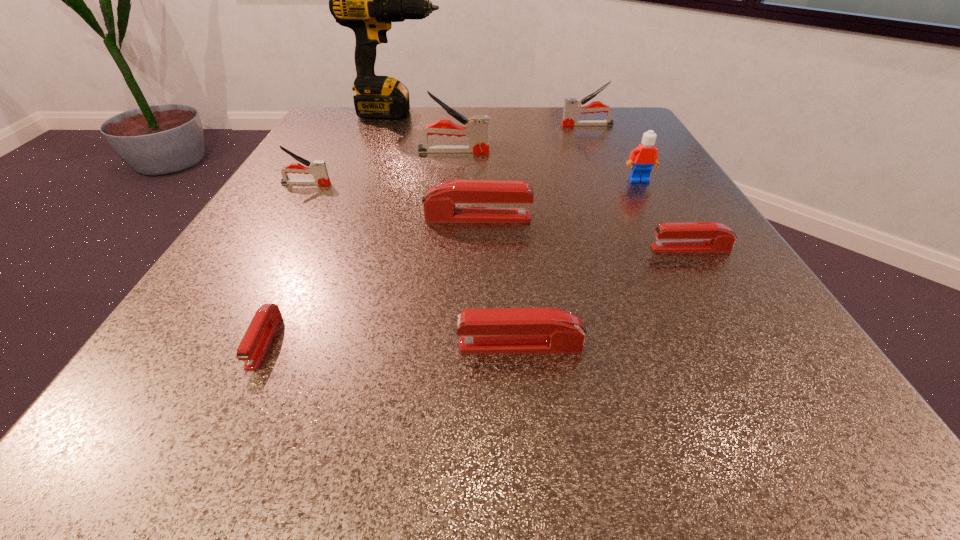
Identify the location of the fourth farthest stapler. (439, 203).

This screenshot has height=540, width=960. I want to click on the third smallest red stapler, so click(500, 330).

Locate an element on the screen. the fifth tallest stapler is located at coordinates (500, 330).

You are a GUI agent. You are given a task and a screenshot of the screen. Output one action in this format:
    pyautogui.click(x=<x>, y=<y>)
    Task: Click on the third nearest red stapler
    
    Given the screenshot: What is the action you would take?
    pyautogui.click(x=704, y=236)

Find the location of a particular element. the eighth tallest object is located at coordinates (704, 236).

Locate an element on the screen. This screenshot has width=960, height=540. the leftmost red stapler is located at coordinates (253, 345).

What are the coordinates of `the shortest object` in the screenshot? It's located at (253, 345).

Identify the location of blank space located 0.350m at the tip of the farthest object. The width and height of the screenshot is (960, 540). (585, 113).

Where is `vacant area situated on the handle side of the second farthest gray stapler`? The image size is (960, 540). vacant area situated on the handle side of the second farthest gray stapler is located at coordinates (536, 152).

Locate an element on the screen. This screenshot has width=960, height=540. free spot located 0.080m on the handle side of the farthest gray stapler is located at coordinates (528, 125).